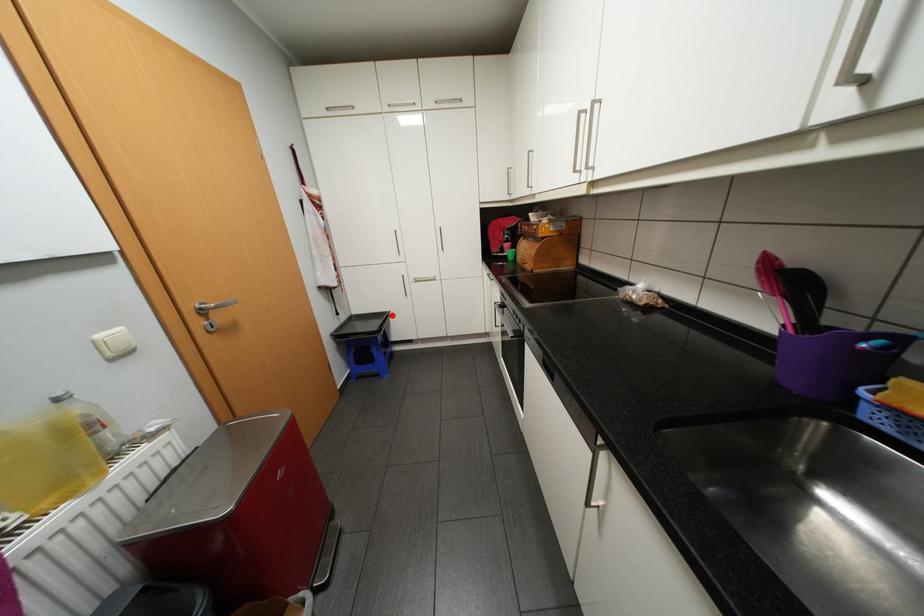
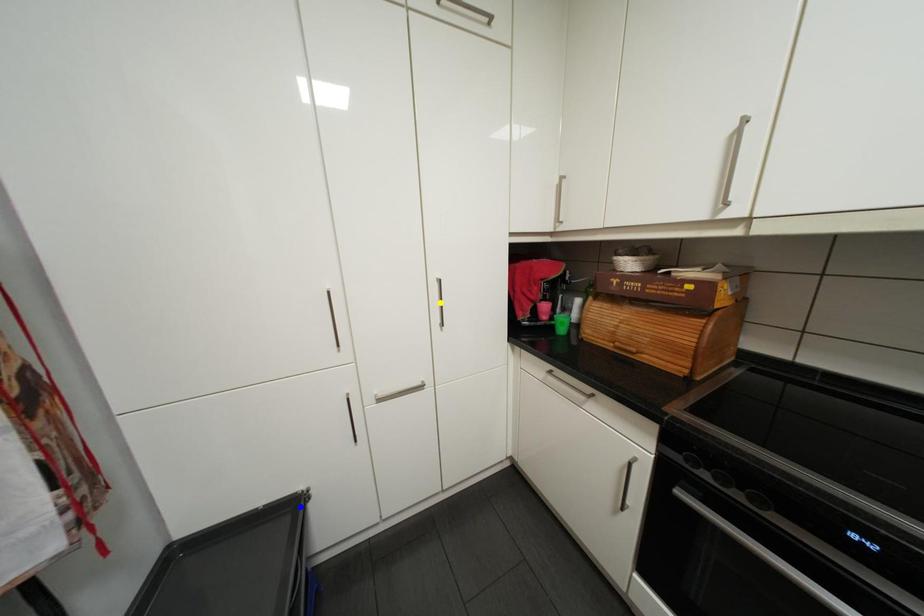
Question: I am providing you with two images of the same scene from different viewpoints. A red point is marked on the first image. You are given multiple points on the second image. Which point in image 2 is actually the same real-world point as the red point in image 1?

Choices:
 (A) yellow point
 (B) blue point
 (C) green point

Answer: (B)